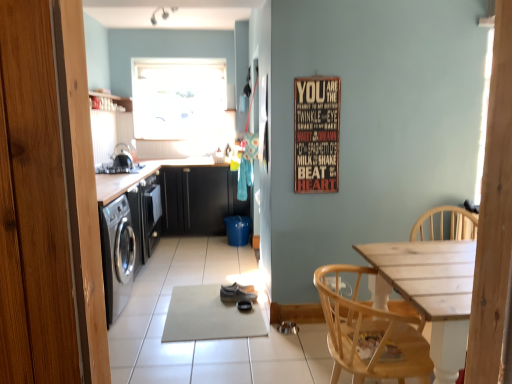
At what (x,y) coordinates should I click in order to perform the action: click on black matte cabinetry at left, which is the second cabinetry from back to front. Please return your answer as a coordinate pair (x, y). This screenshot has height=384, width=512. Looking at the image, I should click on (170, 207).

Image resolution: width=512 pixels, height=384 pixels. What do you see at coordinates (118, 168) in the screenshot?
I see `satin black stove at upper left` at bounding box center [118, 168].

This screenshot has height=384, width=512. Find the location of `black matte cabinetry at left, the 1th cabinetry from the front`. black matte cabinetry at left, the 1th cabinetry from the front is located at coordinates (170, 207).

Looking at their sizes, would you say wooden signboard at upper right is wider or thinner than gray fabric ironing board at center?

Clearly, wooden signboard at upper right has less width compared to gray fabric ironing board at center.

Is wooden signboard at upper right directly adjacent to gray fabric ironing board at center?

No, wooden signboard at upper right is not touching gray fabric ironing board at center.

Looking at this image, is wooden signboard at upper right facing away from gray fabric ironing board at center?

That's not correct — wooden signboard at upper right is not looking away from gray fabric ironing board at center.

Which of these two, wooden signboard at upper right or gray fabric ironing board at center, is bigger?

gray fabric ironing board at center.

Is transparent glass window at upper center not near wooden signboard at upper right?

Yes, transparent glass window at upper center and wooden signboard at upper right are quite far apart.

Does transparent glass window at upper center have a smaller size compared to wooden signboard at upper right?

Actually, transparent glass window at upper center might be larger than wooden signboard at upper right.

Considering the relative positions of transparent glass window at upper center and wooden signboard at upper right in the image provided, is transparent glass window at upper center to the right of wooden signboard at upper right from the viewer's perspective?

In fact, transparent glass window at upper center is to the left of wooden signboard at upper right.

Which object is wider, transparent glass window at upper center or wooden signboard at upper right?

transparent glass window at upper center is wider.

From the image's perspective, would you say wooden signboard at upper right is shown under black matte cabinet at center, which is the first cabinetry from back to front?

Actually, wooden signboard at upper right appears above black matte cabinet at center, which is the first cabinetry from back to front, in the image.

Visually, is wooden signboard at upper right positioned to the left or to the right of black matte cabinet at center, which is the first cabinetry from back to front?

In the image, wooden signboard at upper right appears on the right side of black matte cabinet at center, which is the first cabinetry from back to front.

Find the location of a particular element. This screenshot has width=512, height=384. cabinetry that is the 2nd object located behind the wooden signboard at upper right is located at coordinates (199, 200).

Is wooden signboard at upper right aimed at black matte cabinet at center, the 2th cabinetry viewed from the front?

No, wooden signboard at upper right is not turned towards black matte cabinet at center, the 2th cabinetry viewed from the front.

From the image's perspective, between transparent glass window at upper center and black matte cabinetry at left, which is the second cabinetry from back to front, which one is located above?

From the image's view, transparent glass window at upper center is above.

Can you tell me how much transparent glass window at upper center and black matte cabinetry at left, the 1th cabinetry from the front, differ in facing direction?

transparent glass window at upper center and black matte cabinetry at left, the 1th cabinetry from the front, are facing 90.4 degrees away from each other.

Is transparent glass window at upper center looking in the opposite direction of black matte cabinetry at left, which is the second cabinetry from back to front?

No, transparent glass window at upper center's orientation is not away from black matte cabinetry at left, which is the second cabinetry from back to front.

Is shiny metallic kettle at left shorter than light wood chair at lower right?

Correct, shiny metallic kettle at left is not as tall as light wood chair at lower right.

How many degrees apart are the facing directions of shiny metallic kettle at left and light wood chair at lower right?

There is a 172-degree angle between the facing directions of shiny metallic kettle at left and light wood chair at lower right.

Is light wood chair at lower right completely or partially inside shiny metallic kettle at left?

No, light wood chair at lower right is not inside shiny metallic kettle at left.

Which is nearer, (120, 157) or (329, 330)?

The point (329, 330) is closer to the camera.

Considering the relative sizes of matte gray shoe at center and shiny metallic kettle at left in the image provided, is matte gray shoe at center wider than shiny metallic kettle at left?

No.

Does matte gray shoe at center lie behind shiny metallic kettle at left?

No, it is not.

Is matte gray shoe at center facing away from shiny metallic kettle at left?

No, matte gray shoe at center is not facing the opposite direction of shiny metallic kettle at left.

Considering the positions of point (212, 217) and point (194, 63), is point (212, 217) closer or farther from the camera than point (194, 63)?

Point (212, 217).

Is black matte cabinet at center, the 2th cabinetry viewed from the front, looking in the opposite direction of transparent glass window at upper center?

No, black matte cabinet at center, the 2th cabinetry viewed from the front, is not facing away from transparent glass window at upper center.

Is black matte cabinet at center, which is the first cabinetry from back to front, touching transparent glass window at upper center?

No, black matte cabinet at center, which is the first cabinetry from back to front, is not beside transparent glass window at upper center.

Can you confirm if black matte cabinet at center, the 2th cabinetry viewed from the front, is positioned to the left of transparent glass window at upper center?

Incorrect, black matte cabinet at center, the 2th cabinetry viewed from the front, is not on the left side of transparent glass window at upper center.

Where is `ironing board lying behind the wooden signboard at upper right`? ironing board lying behind the wooden signboard at upper right is located at coordinates (210, 316).

This screenshot has width=512, height=384. What are the coordinates of `window on the left of wooden signboard at upper right` in the screenshot? It's located at (178, 97).

Which object lies nearer to the anchor point gray fabric ironing board at center, transparent glass window at upper center or shiny metallic kettle at left?

Based on the image, shiny metallic kettle at left appears to be nearer to gray fabric ironing board at center.

Looking at the image, which one is located closer to matte gray shoe at center, light wood chair at lower right or black matte cabinetry at left, the 1th cabinetry from the front?

black matte cabinetry at left, the 1th cabinetry from the front.

Estimate the real-world distances between objects in this image. Which object is further from shiny metallic kettle at left, black matte cabinetry at left, the 1th cabinetry from the front, or gray fabric ironing board at center?

Based on the image, gray fabric ironing board at center appears to be further to shiny metallic kettle at left.

Which object lies further to the anchor point gray fabric ironing board at center, matte gray shoe at center or black matte cabinetry at left, the 1th cabinetry from the front?

black matte cabinetry at left, the 1th cabinetry from the front, is positioned further to the anchor gray fabric ironing board at center.

Which object lies further to the anchor point shiny metallic kettle at left, black matte cabinet at center, which is the first cabinetry from back to front, or black matte cabinetry at left, the 1th cabinetry from the front?

The object further to shiny metallic kettle at left is black matte cabinetry at left, the 1th cabinetry from the front.

When comparing their distances from black matte cabinetry at left, which is the second cabinetry from back to front, does satin black stove at upper left or transparent glass window at upper center seem closer?

Based on the image, satin black stove at upper left appears to be nearer to black matte cabinetry at left, which is the second cabinetry from back to front.

Estimate the real-world distances between objects in this image. Which object is closer to gray fabric ironing board at center, black matte cabinetry at left, which is the second cabinetry from back to front, or light wood chair at lower right?

black matte cabinetry at left, which is the second cabinetry from back to front, is positioned closer to the anchor gray fabric ironing board at center.

When comparing their distances from black matte cabinetry at left, the 1th cabinetry from the front, does wooden signboard at upper right or matte gray shoe at center seem closer?

matte gray shoe at center.

Image resolution: width=512 pixels, height=384 pixels. Find the location of `shoe located between light wood chair at lower right and black matte cabinetry at left, the 1th cabinetry from the front, in the depth direction`. shoe located between light wood chair at lower right and black matte cabinetry at left, the 1th cabinetry from the front, in the depth direction is located at coordinates coord(237,293).

You are a GUI agent. You are given a task and a screenshot of the screen. Output one action in this format:
    pyautogui.click(x=<x>, y=<y>)
    Task: Click on the ironing board between wooden signboard at upper right and transparent glass window at upper center in the front-back direction
    The height and width of the screenshot is (384, 512).
    Given the screenshot: What is the action you would take?
    pyautogui.click(x=210, y=316)

Where is `stove between light wood chair at lower right and transparent glass window at upper center in the front-back direction`? stove between light wood chair at lower right and transparent glass window at upper center in the front-back direction is located at coordinates (118, 168).

Where is `appliance positioned between light wood chair at lower right and black matte cabinet at center, which is the first cabinetry from back to front, from near to far`? The image size is (512, 384). appliance positioned between light wood chair at lower right and black matte cabinet at center, which is the first cabinetry from back to front, from near to far is located at coordinates (122, 157).